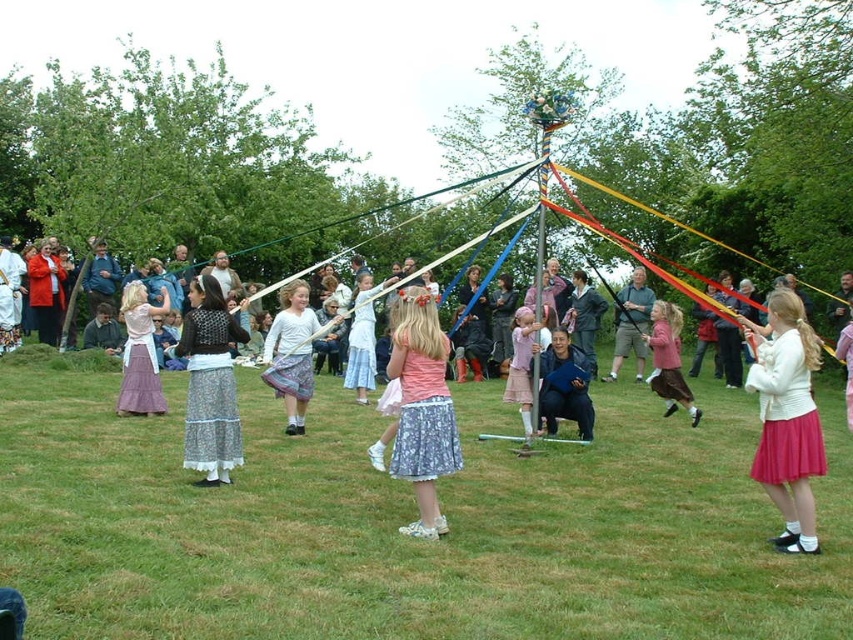
In the Maypole dance scene, there are two participants wearing a floral lace skirt at center and a purple satin dress at center. Which one is located to the right of the other?

The floral lace skirt at center is positioned on the right side of purple satin dress at center.

You are a photographer positioned at the edge of the field, observing the Maypole dance. You want to take a photo that includes both the floral lace skirt at center and the purple satin dress at center. Based on their positions, which one will appear larger in the photo?

The floral lace skirt at center will appear larger in the photo because it is closer to the viewer than the purple satin dress at center.